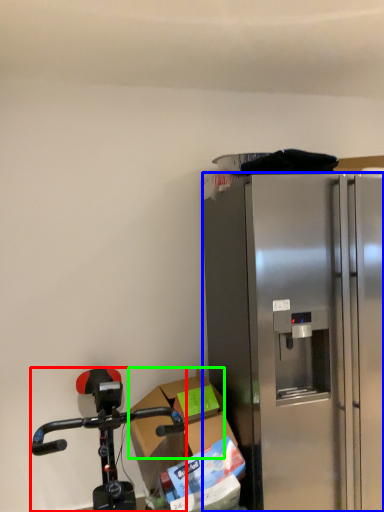
Question: Which object is positioned farthest from bicycle (highlighted by a red box)? Select from refrigerator (highlighted by a blue box) and box (highlighted by a green box).

Choices:
 (A) refrigerator
 (B) box

Answer: (A)